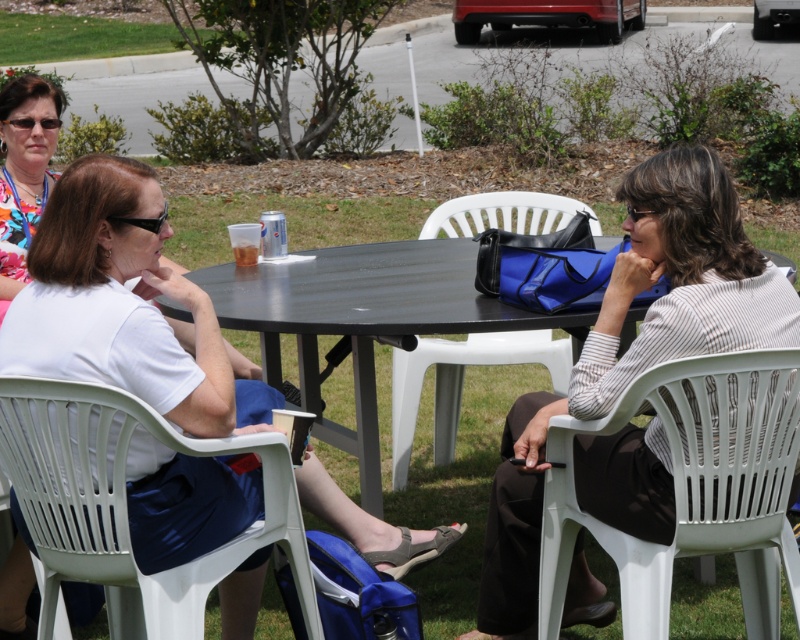
Does white plastic chair at center appear over translucent plastic cup at center?

Incorrect, white plastic chair at center is not positioned above translucent plastic cup at center.

Is point (416, 420) behind point (256, 262)?

Yes.

Identify the location of white plastic chair at center. The width and height of the screenshot is (800, 640). (460, 381).

Does point (768, 419) come in front of point (402, 326)?

That is True.

Which of these two, white plastic chair at right or black plastic table at center, stands shorter?

white plastic chair at right is shorter.

Which is behind, point (786, 376) or point (417, 243)?

The point (417, 243) is more distant.

Identify the location of white plastic chair at right. This screenshot has width=800, height=640. (692, 488).

Can you confirm if striped fabric shirt at center is positioned to the left of white plastic chair at center?

No, striped fabric shirt at center is not to the left of white plastic chair at center.

In the scene shown: Can you confirm if striped fabric shirt at center is positioned to the right of white plastic chair at center?

Yes, striped fabric shirt at center is to the right of white plastic chair at center.

At what (x,y) coordinates should I click in order to perform the action: click on striped fabric shirt at center. Please return your answer as a coordinate pair (x, y). Looking at the image, I should click on (634, 348).

Locate an element on the screen. Image resolution: width=800 pixels, height=640 pixels. striped fabric shirt at center is located at coordinates (634, 348).